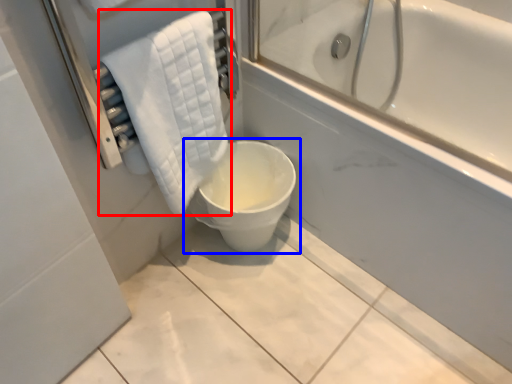
Question: Which object appears closest to the camera in this image, towel (highlighted by a red box) or toilet (highlighted by a blue box)?

Choices:
 (A) towel
 (B) toilet

Answer: (A)